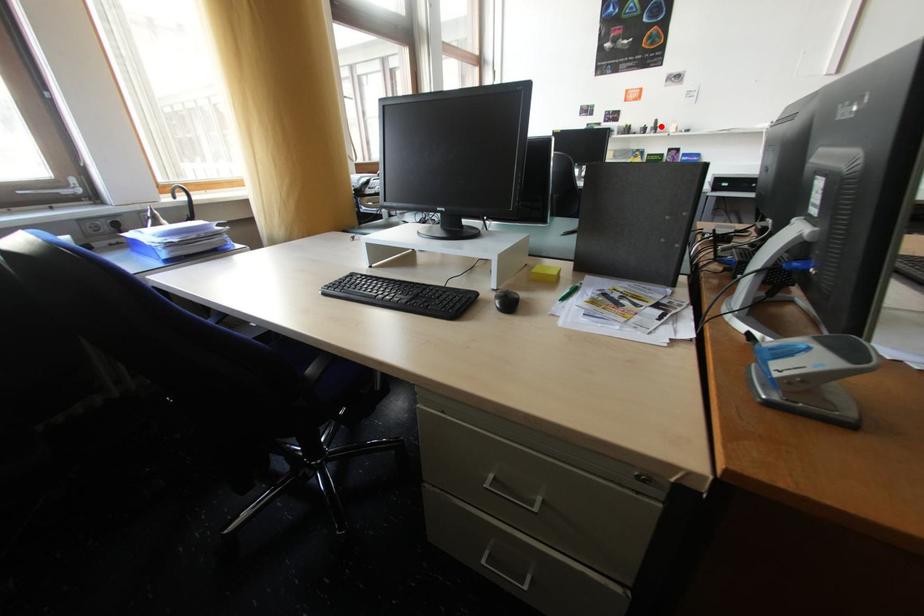
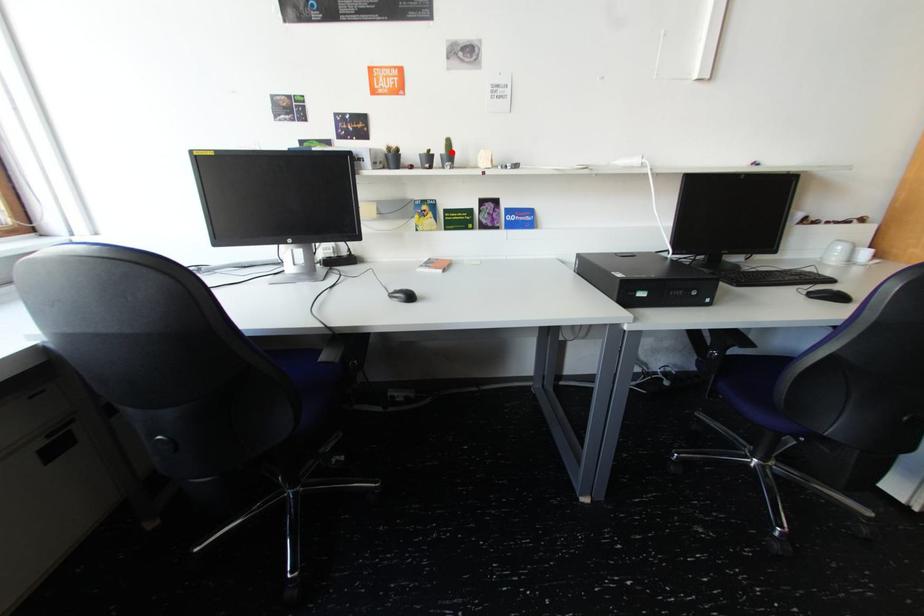
I am providing you with two images of the same scene from different viewpoints. A red point is marked on the first image and another point is marked on the second image. Do the highlighted points in image1 and image2 indicate the same real-world spot?

Yes